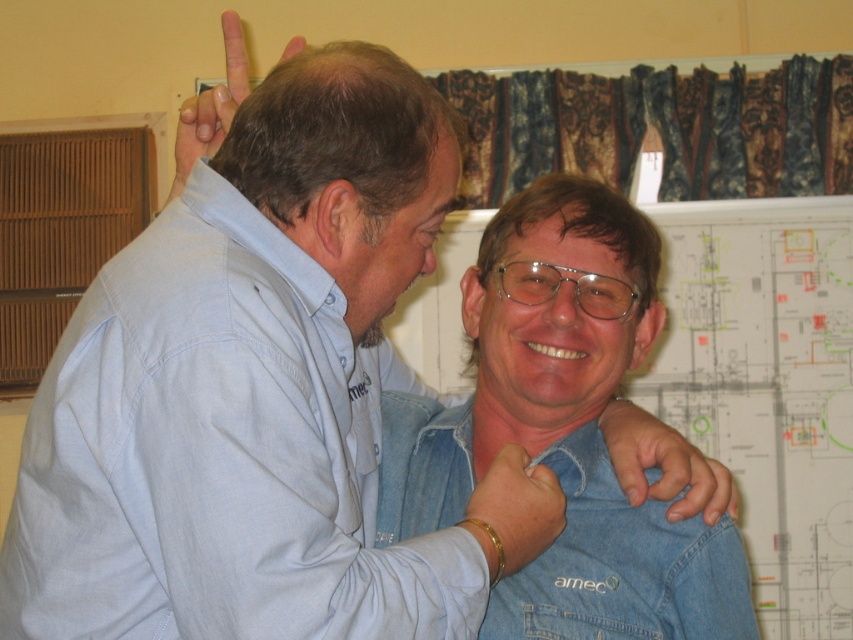
Question: Can you confirm if gold bracelet at center is positioned above matte skin at upper center?

Choices:
 (A) yes
 (B) no

Answer: (B)

Question: Estimate the real-world distances between objects in this image. Which object is closer to the smooth denim hand at center?

Choices:
 (A) gold bracelet at center
 (B) matte skin at upper center

Answer: (A)

Question: Where is smooth denim hand at center located in relation to matte skin at upper center in the image?

Choices:
 (A) above
 (B) below

Answer: (B)

Question: Does smooth denim hand at center appear on the left side of matte skin at upper center?

Choices:
 (A) yes
 (B) no

Answer: (B)

Question: Which of the following is the closest to the observer?

Choices:
 (A) (614, 470)
 (B) (515, 550)
 (C) (206, 113)

Answer: (B)

Question: Which object appears farthest from the camera in this image?

Choices:
 (A) smooth denim hand at center
 (B) gold bracelet at center

Answer: (A)